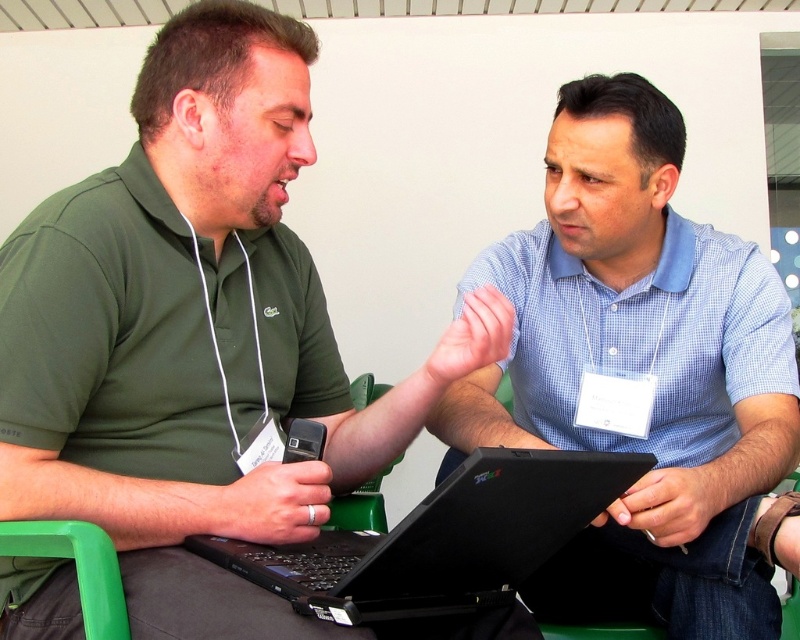
You are a delivery robot that needs to pass between the green matte shirt at center and the blue checkered shirt at center. Your width is 40 centimeters. Can you fit through the space between them?

The distance between the green matte shirt at center and the blue checkered shirt at center is 43.00 centimeters. Since your width is 40 centimeters, you can fit through the space between them.

Where is the green matte shirt at center located in the image?

The green matte shirt at center is located at point coordinates of (196, 336).